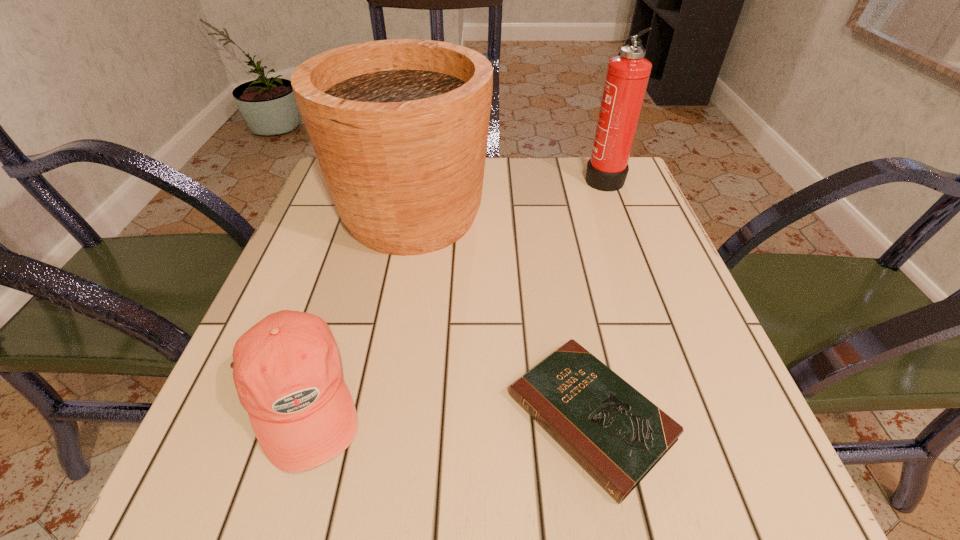
Where is `object located in the far right corner section of the desktop`? object located in the far right corner section of the desktop is located at coordinates coord(627,76).

At what (x,y) coordinates should I click in order to perform the action: click on object that is positioned at the near right corner. Please return your answer as a coordinate pair (x, y). The image size is (960, 540). Looking at the image, I should click on (617, 435).

At what (x,y) coordinates should I click in order to perform the action: click on vacant space at the far edge. Please return your answer as a coordinate pair (x, y). The image size is (960, 540). Looking at the image, I should click on (496, 162).

Where is `free location at the near edge`? This screenshot has width=960, height=540. free location at the near edge is located at coordinates (331, 504).

The height and width of the screenshot is (540, 960). I want to click on free space at the right edge, so click(666, 320).

The width and height of the screenshot is (960, 540). What are the coordinates of `free space at the near right corner of the desktop` in the screenshot? It's located at (665, 456).

This screenshot has height=540, width=960. In order to click on free spot between the flowerpot and the Bible in this screenshot , I will do `click(501, 316)`.

At what (x,y) coordinates should I click in order to perform the action: click on unoccupied position between the third tallest object and the flowerpot. Please return your answer as a coordinate pair (x, y). This screenshot has height=540, width=960. Looking at the image, I should click on (355, 307).

You are a GUI agent. You are given a task and a screenshot of the screen. Output one action in this format:
    pyautogui.click(x=<x>, y=<y>)
    Task: Click on the empty location between the flowerpot and the fire extinguisher
    
    Given the screenshot: What is the action you would take?
    pyautogui.click(x=508, y=196)

Identify the location of vacant point located between the second shortest object and the fire extinguisher. (451, 288).